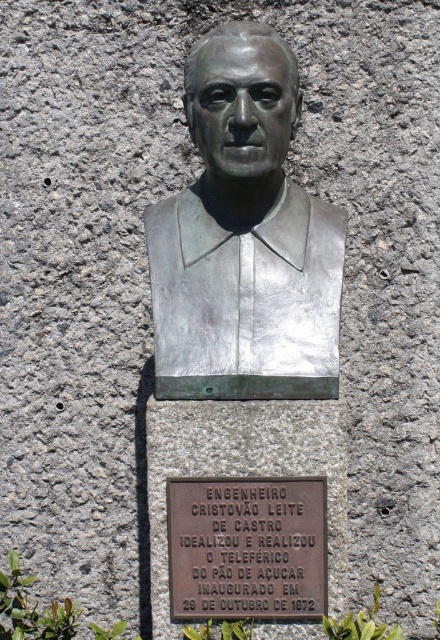
Question: Which point is farther to the camera?

Choices:
 (A) (168, 492)
 (B) (326, 369)

Answer: (A)

Question: Can you confirm if bronze bust at center is positioned to the left of bronze plaque at center?

Choices:
 (A) yes
 (B) no

Answer: (A)

Question: Which object is farther from the camera taking this photo?

Choices:
 (A) bronze bust at center
 (B) bronze plaque at center

Answer: (B)

Question: Is bronze bust at center closer to camera compared to bronze plaque at center?

Choices:
 (A) yes
 (B) no

Answer: (A)

Question: Does bronze bust at center have a lesser width compared to bronze plaque at center?

Choices:
 (A) yes
 (B) no

Answer: (B)